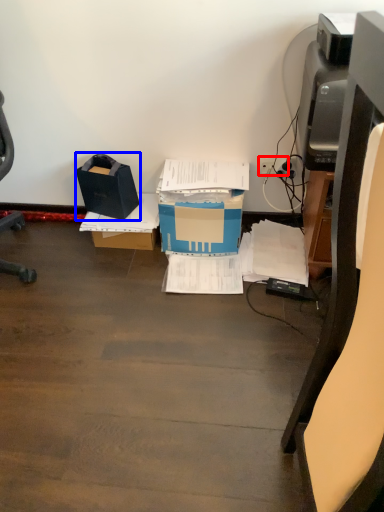
Question: Which of the following is the farthest to the observer, plug (highlighted by a red box) or box (highlighted by a blue box)?

Choices:
 (A) plug
 (B) box

Answer: (A)